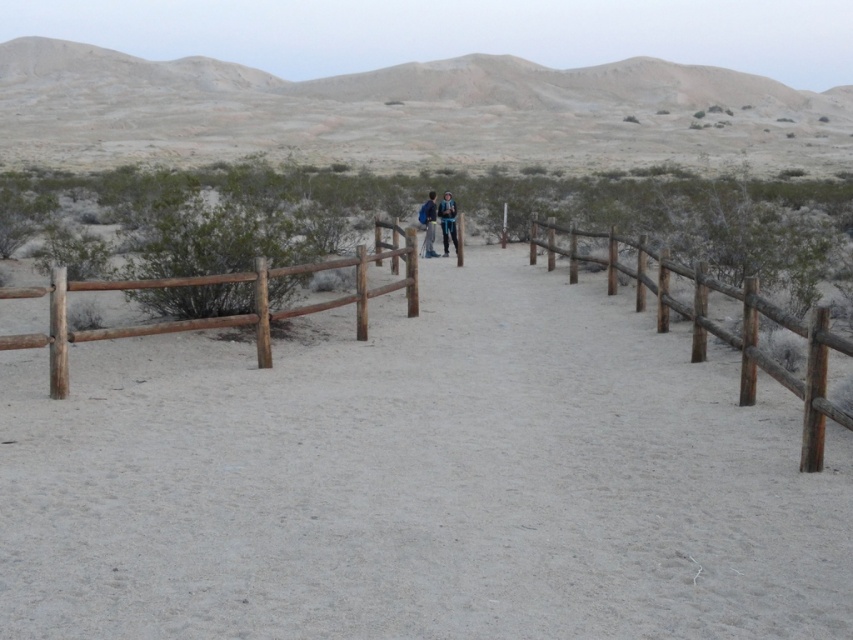
You are a traveler walking along the sandy path and see the brown wooden fence at left and the blue denim jacket at center. Which object is wider?

The brown wooden fence at left is wider than the blue denim jacket at center.